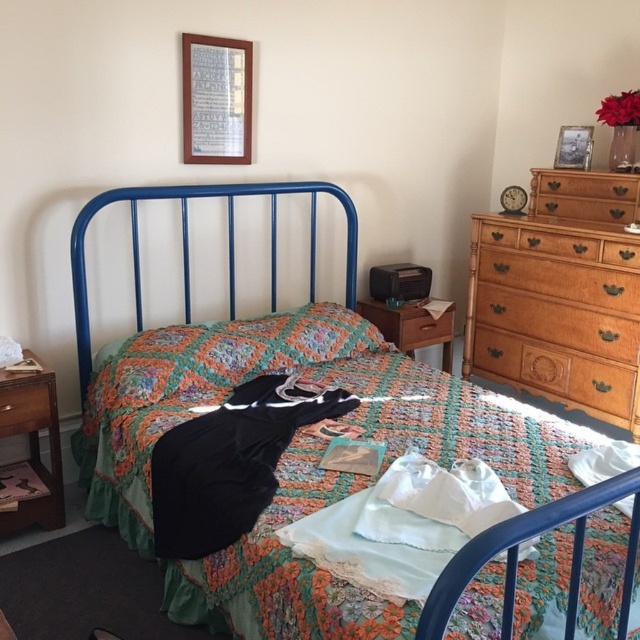
You are organizing the bedroom and need to place a large box that requires 2 meters of space. The brown wood dresser at right and wooden drawer at left are in the way. Which object should you move to free up more horizontal space?

The brown wood dresser at right should be moved because its width is larger than the wooden drawer at left, so moving it would free up more horizontal space.

You are organizing the bedroom and need to place a new rug under the brown wood drawer at center. However, the rug is only large enough to fit under the metallic blue bed at center. Can the rug be placed under the drawer?

The metallic blue bed at center is above the brown wood drawer at center, so the rug placed under the metallic blue bed at center would not reach the brown wood drawer at center. Therefore, the rug cannot be placed under the drawer.

You are organizing your bedroom and want to place a tall lamp on the light brown wooden dresser at right and a shorter vase on the wooden drawer at left. Based on their heights, will both items fit appropriately on their respective furniture?

The light brown wooden dresser at right has a greater height compared to the wooden drawer at left, so the tall lamp will fit well on the taller dresser, and the shorter vase will also fit appropriately on the shorter drawer.